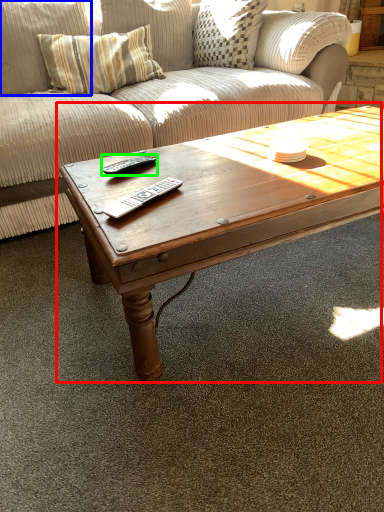
Question: Which object is positioned closest to coffee table (highlighted by a red box)? Select from pillow (highlighted by a blue box) and remote (highlighted by a green box).

Choices:
 (A) pillow
 (B) remote

Answer: (B)